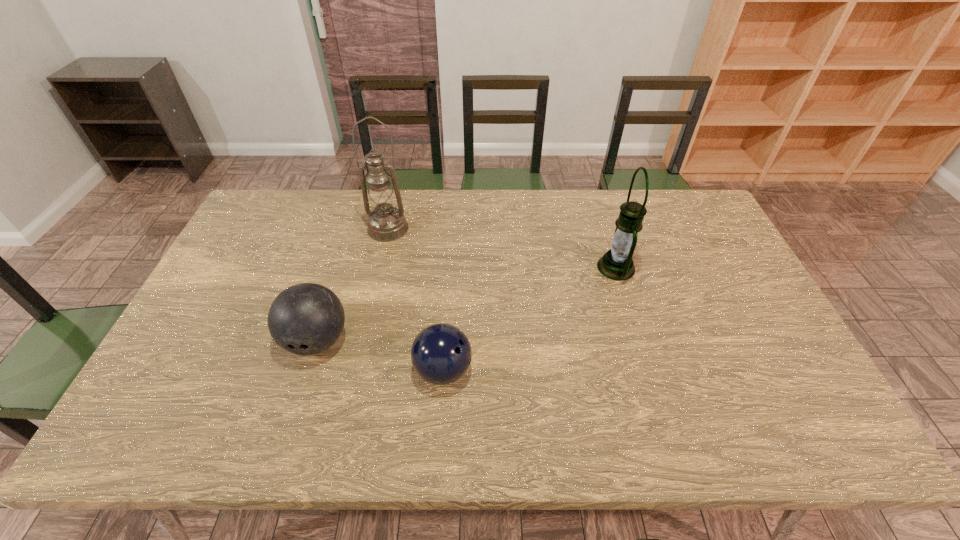
Point out which object is positioned as the nearest to the oil lamp. Please provide its 2D coordinates. Your answer should be formatted as a tuple, i.e. [(x, y)], where the tuple contains the x and y coordinates of a point satisfying the conditions above.

[(305, 319)]

The image size is (960, 540). I want to click on free spot that satisfies the following two spatial constraints: 1. on the side where the lantern emits light; 2. on the grip area of the second shortest object, so click(638, 340).

You are a GUI agent. You are given a task and a screenshot of the screen. Output one action in this format:
    pyautogui.click(x=<x>, y=<y>)
    Task: Click on the vacant region that satisfies the following two spatial constraints: 1. on the side where the lantern emits light; 2. on the grip area of the left bowling ball
    
    Given the screenshot: What is the action you would take?
    pyautogui.click(x=638, y=340)